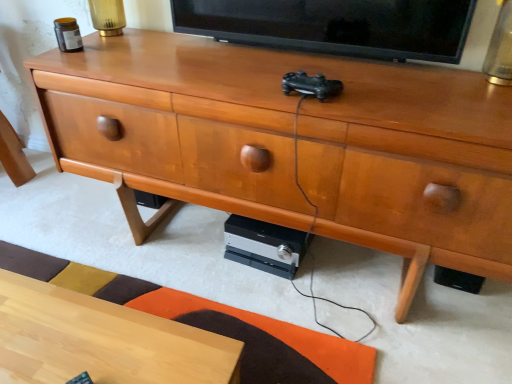
Question: Is silver/black plastic stereo at lower center positioned behind black glossy tv at upper center?

Choices:
 (A) yes
 (B) no

Answer: (A)

Question: Is the surface of silver/black plastic stereo at lower center in direct contact with black glossy tv at upper center?

Choices:
 (A) no
 (B) yes

Answer: (A)

Question: From a real-world perspective, is silver/black plastic stereo at lower center physically below black glossy tv at upper center?

Choices:
 (A) no
 (B) yes

Answer: (B)

Question: Is silver/black plastic stereo at lower center thinner than black glossy tv at upper center?

Choices:
 (A) yes
 (B) no

Answer: (B)

Question: Would you say silver/black plastic stereo at lower center is outside black glossy tv at upper center?

Choices:
 (A) yes
 (B) no

Answer: (A)

Question: Looking at their shapes, would you say light wood desk at lower left is wider or thinner than silver/black plastic stereo at lower center?

Choices:
 (A) thin
 (B) wide

Answer: (A)

Question: From a real-world perspective, is light wood desk at lower left physically located above or below silver/black plastic stereo at lower center?

Choices:
 (A) below
 (B) above

Answer: (B)

Question: Considering their positions, is light wood desk at lower left located in front of or behind silver/black plastic stereo at lower center?

Choices:
 (A) front
 (B) behind

Answer: (A)

Question: Is light wood desk at lower left situated inside silver/black plastic stereo at lower center or outside?

Choices:
 (A) outside
 (B) inside

Answer: (A)

Question: Relative to black glossy tv at upper center, is silver/black plastic stereo at lower center in front or behind?

Choices:
 (A) behind
 (B) front

Answer: (A)

Question: In terms of size, does silver/black plastic stereo at lower center appear bigger or smaller than black glossy tv at upper center?

Choices:
 (A) big
 (B) small

Answer: (B)

Question: Considering the positions of point (232, 235) and point (355, 31), is point (232, 235) closer or farther from the camera than point (355, 31)?

Choices:
 (A) farther
 (B) closer

Answer: (A)

Question: Is silver/black plastic stereo at lower center wider or thinner than black glossy tv at upper center?

Choices:
 (A) wide
 (B) thin

Answer: (A)

Question: In terms of size, does black glossy tv at upper center appear bigger or smaller than light wood desk at lower left?

Choices:
 (A) small
 (B) big

Answer: (A)

Question: Considering the positions of point (455, 18) and point (42, 352), is point (455, 18) closer or farther from the camera than point (42, 352)?

Choices:
 (A) closer
 (B) farther

Answer: (B)